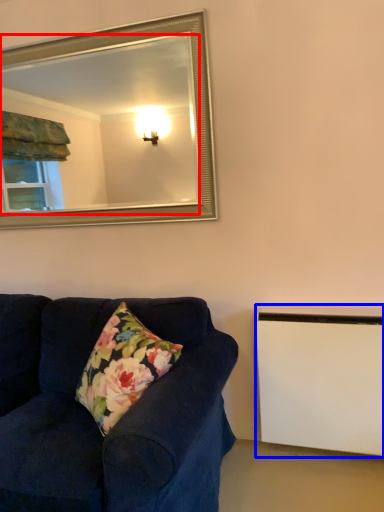
Question: Among these objects, which one is farthest to the camera, mirror (highlighted by a red box) or radiator (highlighted by a blue box)?

Choices:
 (A) mirror
 (B) radiator

Answer: (A)